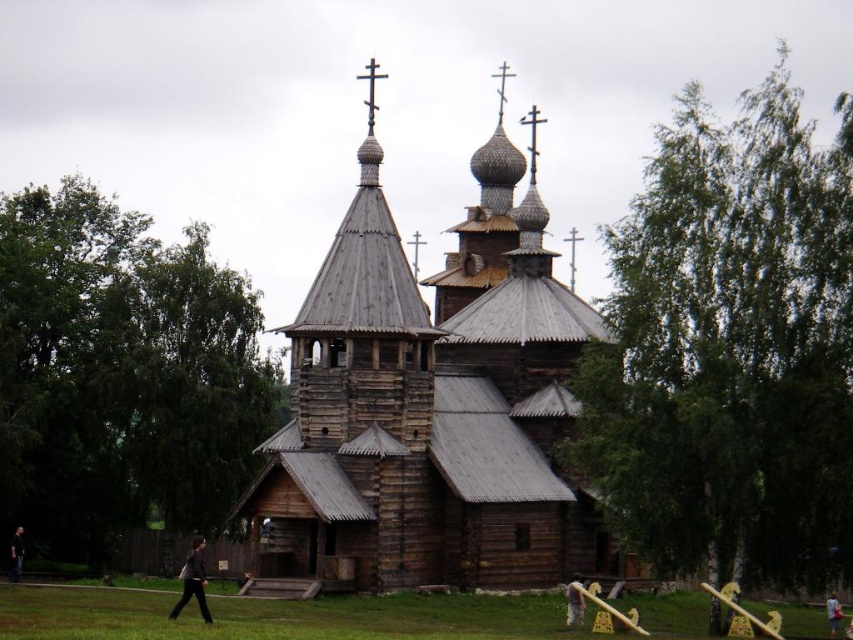
Measure the distance between point [792,625] and camera.

Point [792,625] and camera are 97.81 meters apart.

Based on the photo, between green grass at lower center and brown leather jacket at lower center, which one appears on the right side from the viewer's perspective?

Positioned to the right is brown leather jacket at lower center.

I want to click on green grass at lower center, so click(x=276, y=616).

In the scene shown: Is green grass at lower center to the right of dark brown wooden person at lower left from the viewer's perspective?

Correct, you'll find green grass at lower center to the right of dark brown wooden person at lower left.

Does point (229, 634) lie behind point (15, 557)?

That is False.

You are a GUI agent. You are given a task and a screenshot of the screen. Output one action in this format:
    pyautogui.click(x=<x>, y=<y>)
    Task: Click on the green grass at lower center
    The width and height of the screenshot is (853, 640).
    Given the screenshot: What is the action you would take?
    pyautogui.click(x=276, y=616)

Is green grass at lower center closer to the viewer compared to dark gray fabric at lower center?

That is True.

Consider the image. Does green grass at lower center have a lesser height compared to dark gray fabric at lower center?

Correct, green grass at lower center is not as tall as dark gray fabric at lower center.

Between point (16, 604) and point (186, 579), which one is positioned behind?

The point (16, 604) is more distant.

Find the location of a particular element. green grass at lower center is located at coordinates (276, 616).